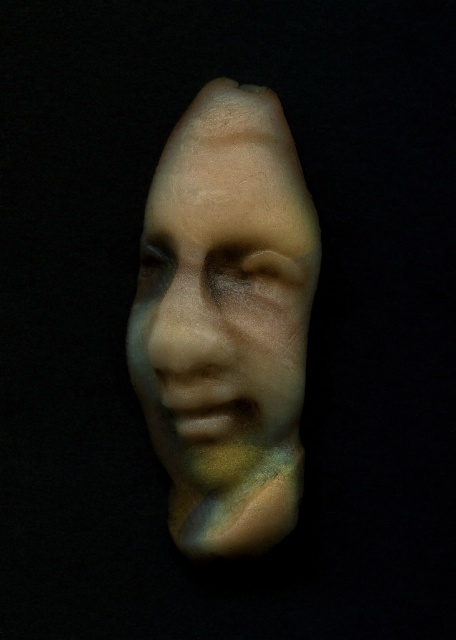
Who is taller, iridescent plastic face at center or matte beige nose at center?

iridescent plastic face at center

Can you confirm if iridescent plastic face at center is shorter than matte beige nose at center?

In fact, iridescent plastic face at center may be taller than matte beige nose at center.

Where is `iridescent plastic face at center`? iridescent plastic face at center is located at coordinates (222, 307).